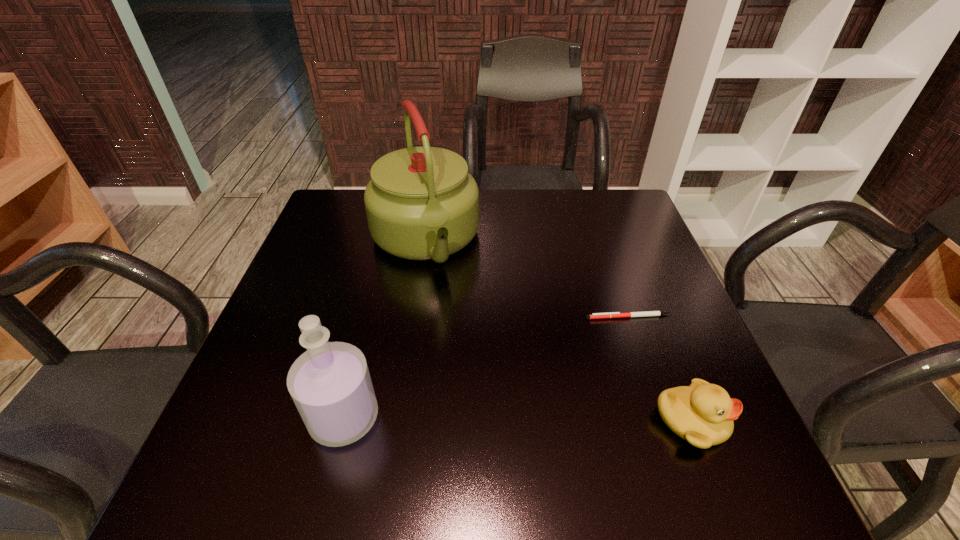
You are a GUI agent. You are given a task and a screenshot of the screen. Output one action in this format:
    pyautogui.click(x=<x>, y=<y>)
    Task: Click on the free space between the farthest object and the perfume
    The height and width of the screenshot is (540, 960).
    Given the screenshot: What is the action you would take?
    384,329

Where is `empty location between the second farthest object and the farthest object`? Image resolution: width=960 pixels, height=540 pixels. empty location between the second farthest object and the farthest object is located at coordinates (527, 279).

Image resolution: width=960 pixels, height=540 pixels. What are the coordinates of `free spot between the shortest object and the tallest object` in the screenshot? It's located at (527, 279).

I want to click on empty space that is in between the third shortest object and the farthest object, so click(384, 329).

You are a GUI agent. You are given a task and a screenshot of the screen. Output one action in this format:
    pyautogui.click(x=<x>, y=<y>)
    Task: Click on the empty space between the shortest object and the duckling
    This screenshot has height=540, width=960.
    Given the screenshot: What is the action you would take?
    pyautogui.click(x=660, y=369)

The height and width of the screenshot is (540, 960). What are the coordinates of `blank region between the duckling and the perfume` in the screenshot? It's located at (517, 419).

What are the coordinates of `free space between the farthest object and the second farthest object` in the screenshot? It's located at (527, 279).

Locate an element on the screen. empty location between the shortest object and the second tallest object is located at coordinates 487,367.

The height and width of the screenshot is (540, 960). I want to click on vacant area that lies between the tallest object and the shortest object, so click(x=527, y=279).

The height and width of the screenshot is (540, 960). Identify the location of free point between the shortest object and the duckling. (660, 369).